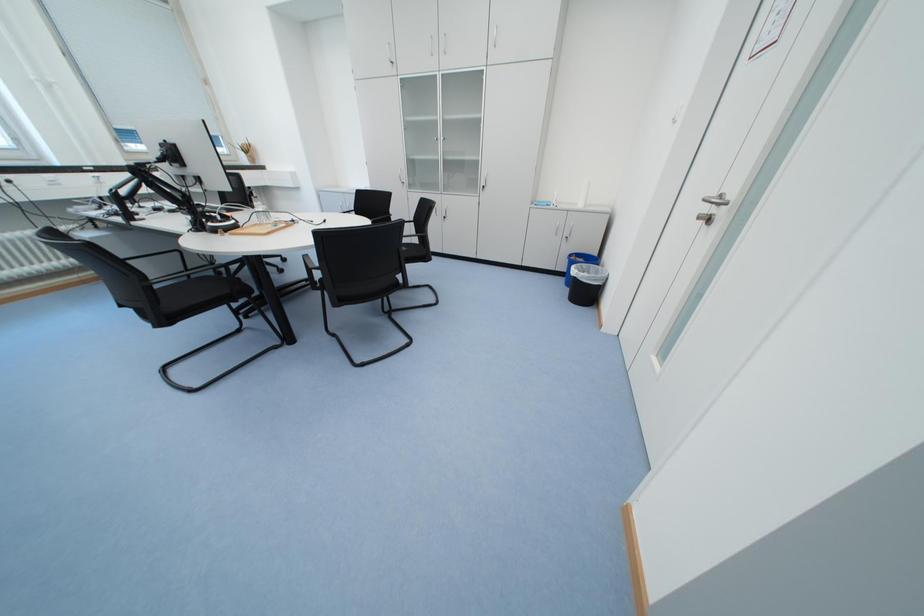
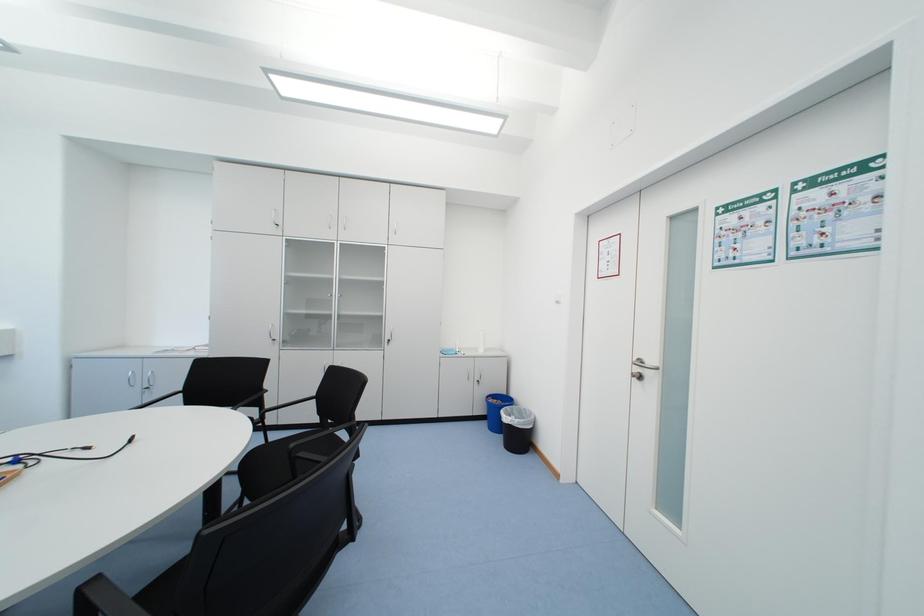
First-person continuous shooting, in which direction is the camera rotating?

The camera rotated toward right-up.